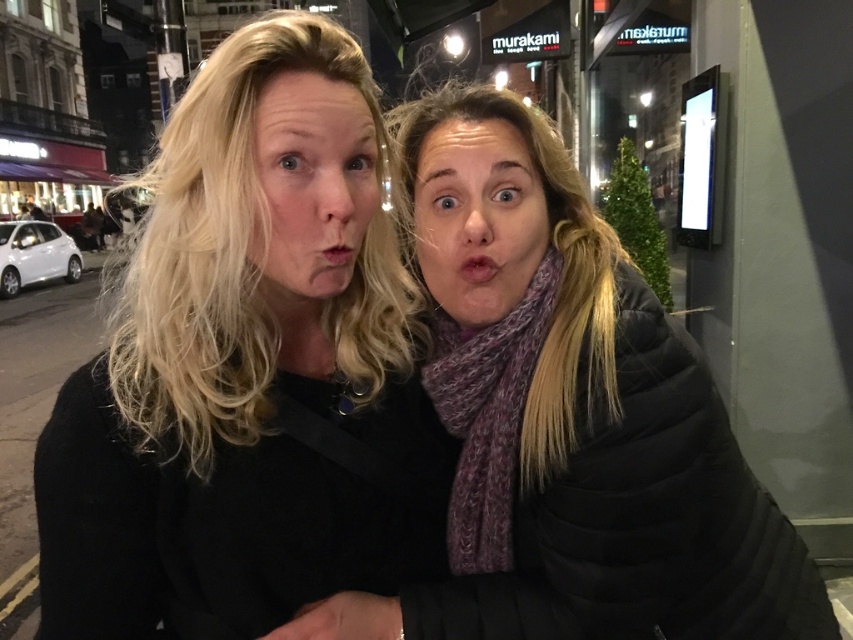
Does matte black jacket at left have a greater height compared to matte black face at center?

Correct, matte black jacket at left is much taller as matte black face at center.

How far apart are matte black jacket at left and matte black face at center?

matte black jacket at left and matte black face at center are 2.63 inches apart.

Between point (152, 451) and point (254, 168), which one is positioned in front?

Positioned in front is point (254, 168).

Identify the location of matte black jacket at left. (248, 371).

Who is higher up, matte black face at center or purple scarf at center?

purple scarf at center

Can you confirm if matte black face at center is positioned above purple scarf at center?

No.

Locate an element on the screen. matte black face at center is located at coordinates (312, 184).

Who is positioned more to the left, matte black jacket at left or purple scarf at center?

matte black jacket at left is more to the left.

Based on the photo, which of these two, matte black jacket at left or purple scarf at center, stands shorter?

Standing shorter between the two is purple scarf at center.

Where is `matte black jacket at left`? This screenshot has width=853, height=640. matte black jacket at left is located at coordinates (248, 371).